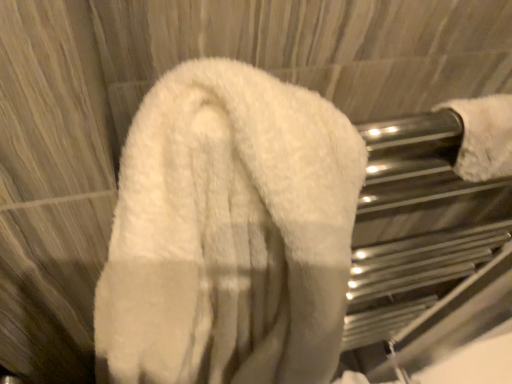
What do you see at coordinates (229, 233) in the screenshot?
I see `white fluffy towel at center` at bounding box center [229, 233].

The width and height of the screenshot is (512, 384). I want to click on white fluffy towel at center, so click(x=229, y=233).

Image resolution: width=512 pixels, height=384 pixels. Find the location of `white fluffy towel at center`. white fluffy towel at center is located at coordinates (229, 233).